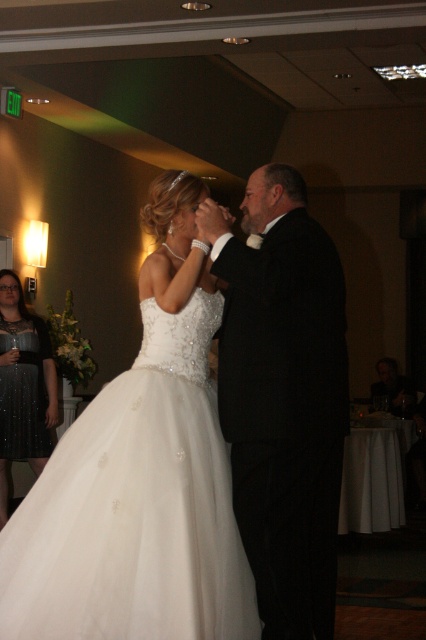
Between point (305, 336) and point (26, 364), which one is positioned in front?

Positioned in front is point (305, 336).

Who is higher up, black satin suit at center or sparkly black dress at left?

black satin suit at center is higher up.

Between point (307, 422) and point (2, 323), which one is positioned behind?

The point (2, 323) is behind.

The height and width of the screenshot is (640, 426). I want to click on black satin suit at center, so click(284, 401).

Who is more distant from viewer, (164, 273) or (31, 340)?

Point (31, 340)

Is point (189, 336) positioned in front of point (8, 332)?

Yes.

I want to click on white satin dress at center, so click(x=140, y=477).

Which is more to the right, white satin dress at center or black satin suit at center?

Positioned to the right is black satin suit at center.

Is point (89, 506) less distant than point (330, 513)?

That is True.

Where is `white satin dress at center`? The height and width of the screenshot is (640, 426). white satin dress at center is located at coordinates (140, 477).